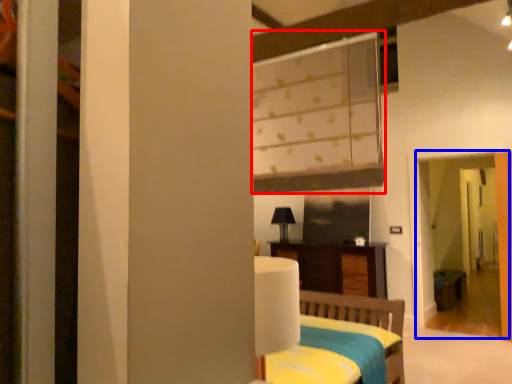
Question: Which object is further to the camera taking this photo, window (highlighted by a red box) or screen door (highlighted by a blue box)?

Choices:
 (A) window
 (B) screen door

Answer: (B)